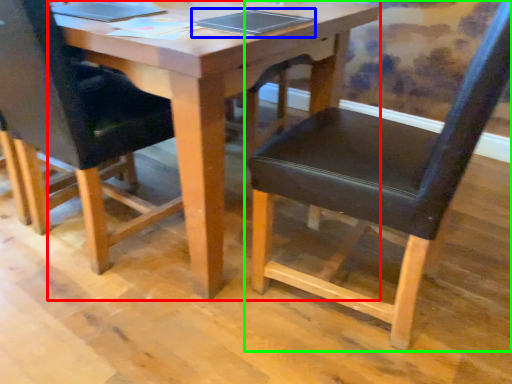
Question: Considering the real-world distances, which object is farthest from table (highlighted by a red box)? notebook (highlighted by a blue box) or chair (highlighted by a green box)?

Choices:
 (A) notebook
 (B) chair

Answer: (B)